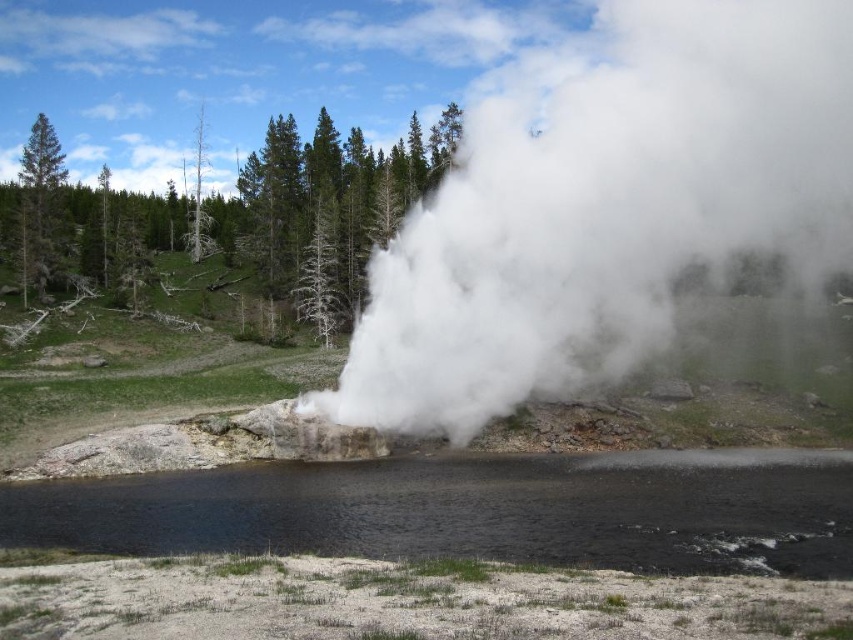
Question: Which is nearer to the dead wood tree at upper left?

Choices:
 (A) white vapor at center
 (B) green matte tree at left
 (C) black smooth water at lower center

Answer: (B)

Question: Can you confirm if white vapor at center is bigger than green matte tree at left?

Choices:
 (A) yes
 (B) no

Answer: (A)

Question: Observing the image, what is the correct spatial positioning of white vapor at center in reference to dead wood tree at upper left?

Choices:
 (A) above
 (B) below

Answer: (A)

Question: Is green matte tree at left wider than dead wood tree at upper left?

Choices:
 (A) yes
 (B) no

Answer: (A)

Question: Which object is farther from the camera taking this photo?

Choices:
 (A) dead wood tree at upper left
 (B) green matte tree at left

Answer: (A)

Question: Which object appears closest to the camera in this image?

Choices:
 (A) green matte tree at left
 (B) black smooth water at lower center
 (C) white vapor at center

Answer: (B)